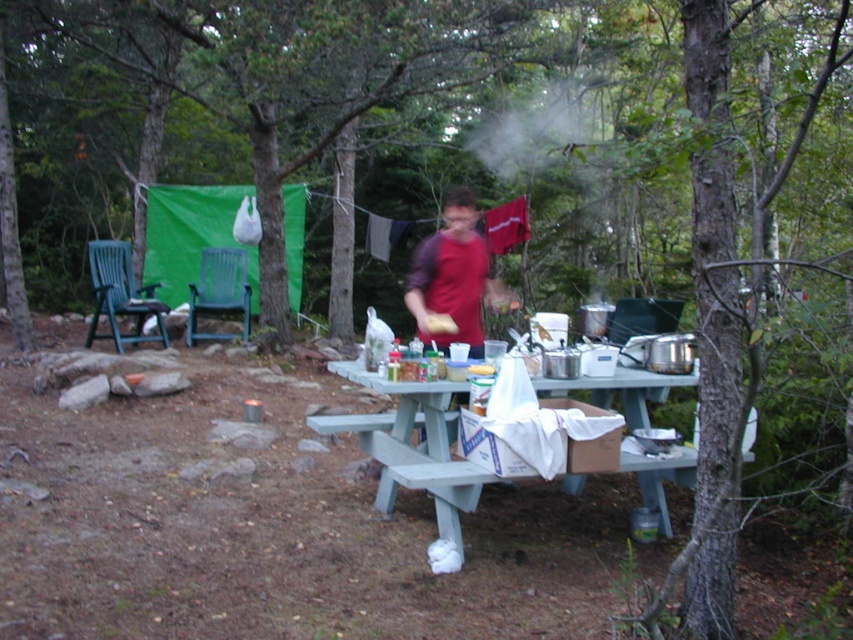
Does point (403, 384) come closer to viewer compared to point (413, 300)?

Yes.

Is point (669, 529) positioned in front of point (469, 337)?

Yes, point (669, 529) is in front of point (469, 337).

Locate an element on the screen. Image resolution: width=853 pixels, height=640 pixels. green painted wood picnic table at center is located at coordinates (418, 449).